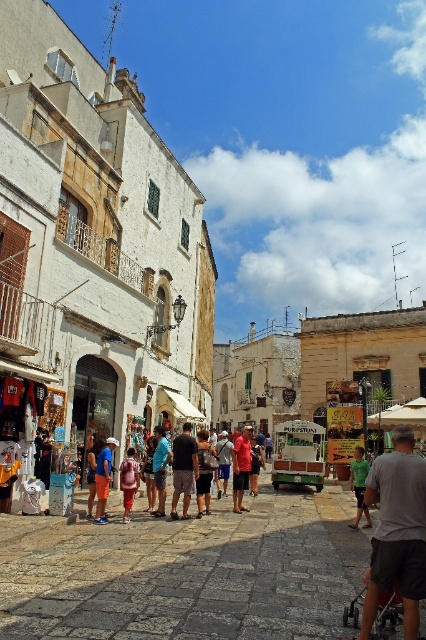
Question: Among these objects, which one is farthest from the camera?

Choices:
 (A) dark brown leather backpack at center
 (B) orange cotton shorts at center
 (C) denim shorts at center

Answer: (C)

Question: Which object appears closest to the camera in this image?

Choices:
 (A) orange cotton shorts at center
 (B) red shirt at center

Answer: (A)

Question: Where is orange cotton shorts at center located in relation to denim shorts at center in the image?

Choices:
 (A) left
 (B) right

Answer: (A)

Question: Which object is positioned closest to the gray fabric stroller at lower right?

Choices:
 (A) denim shorts at center
 (B) green cotton shirt at center
 (C) orange cotton shorts at center

Answer: (B)

Question: Is dark brown leather backpack at center above red shirt at center?

Choices:
 (A) no
 (B) yes

Answer: (B)

Question: Is gray fabric stroller at lower right positioned behind dark brown leather backpack at center?

Choices:
 (A) no
 (B) yes

Answer: (A)